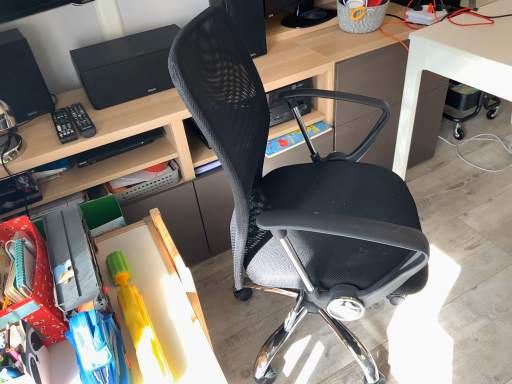
Question: In terms of width, does black plastic remote control at left, which is counted as the first remote control, starting from the right, look wider or thinner when compared to white glossy desk at lower right, acting as the 3th desk starting from the left?

Choices:
 (A) thin
 (B) wide

Answer: (A)

Question: Considering the positions of point (80, 114) and point (493, 28), is point (80, 114) closer or farther from the camera than point (493, 28)?

Choices:
 (A) farther
 (B) closer

Answer: (B)

Question: Estimate the real-world distances between objects in this image. Which object is farther from the rubber yellow toy at lower left?

Choices:
 (A) black matte speaker at upper left, the first loudspeaker when ordered from left to right
 (B) black mesh speaker at upper center, the first loudspeaker in the right-to-left sequence
 (C) black plastic remote control at left, which is the first remote control from left to right
 (D) black plastic remote control at left, which is counted as the first remote control, starting from the right
 (E) wooden toy at lower left, positioned as the first desk in left-to-right order

Answer: (B)

Question: Estimate the real-world distances between objects in this image. Which object is farther from the black mesh speaker at upper center, marked as the 2th loudspeaker in a left-to-right arrangement?

Choices:
 (A) black mesh chair at center, placed as the second desk when sorted from left to right
 (B) white glossy desk at lower right, which ranks as the 1th desk in right-to-left order
 (C) rubber yellow toy at lower left
 (D) wooden toy at lower left, acting as the 3th desk starting from the right
 (E) black plastic remote control at left, which is counted as the first remote control, starting from the right

Answer: (C)